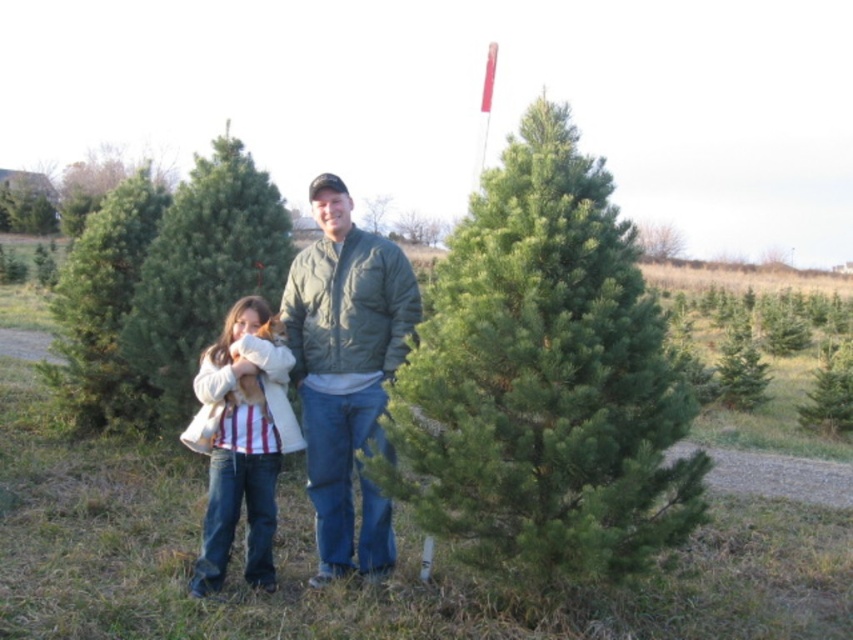
Question: Which point appears closest to the camera in this image?

Choices:
 (A) (119, 330)
 (B) (248, 548)

Answer: (B)

Question: Can you confirm if green matte jacket at center is thinner than white fleece jacket at center?

Choices:
 (A) yes
 (B) no

Answer: (A)

Question: Is the position of green needle-like at center less distant than that of green matte christmas tree at center?

Choices:
 (A) no
 (B) yes

Answer: (B)

Question: Which object is the farthest from the green matte jacket at center?

Choices:
 (A) white fleece jacket at center
 (B) green needle-like at center
 (C) green matte christmas tree at center

Answer: (C)

Question: Is green needle-like at center bigger than green matte jacket at center?

Choices:
 (A) yes
 (B) no

Answer: (A)

Question: Which is farther from the green matte pine at left?

Choices:
 (A) green matte jacket at center
 (B) green needle-like at center
 (C) white fleece jacket at center
 (D) green matte christmas tree at center

Answer: (A)